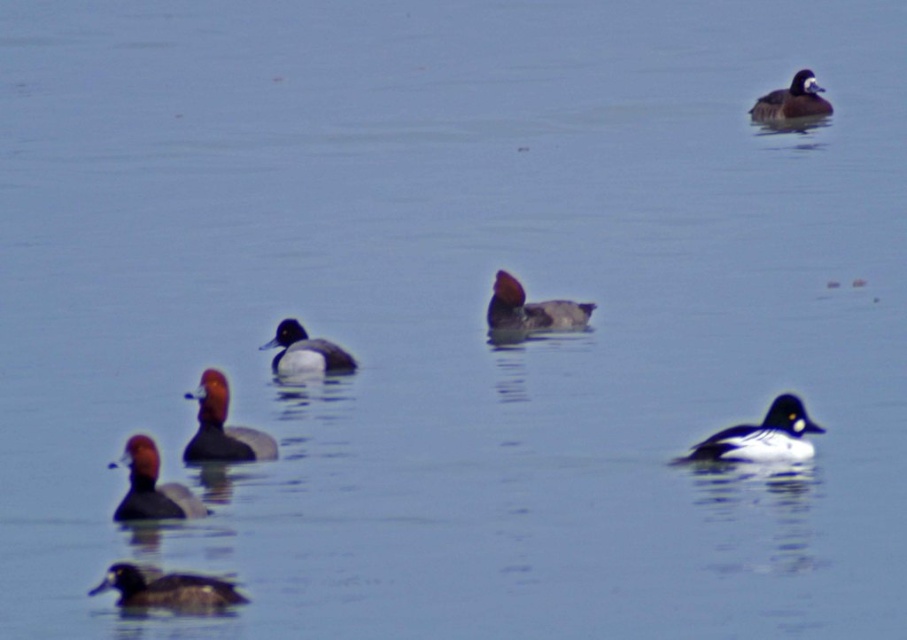
Identify the location of white glossy duck at right. The width and height of the screenshot is (907, 640). (762, 436).

Is white glossy duck at right positioned behind brown matte duck at center?

No, it is not.

What do you see at coordinates (762, 436) in the screenshot? I see `white glossy duck at right` at bounding box center [762, 436].

Where is `white glossy duck at right`? white glossy duck at right is located at coordinates (762, 436).

Who is more forward, (712, 449) or (138, 468)?

Positioned in front is point (138, 468).

Measure the distance between point [773,401] and camera.

9.67 meters

Is point (724, 460) in front of point (149, 492)?

No, (724, 460) is further to viewer.

You are a GUI agent. You are given a task and a screenshot of the screen. Output one action in this format:
    pyautogui.click(x=<x>, y=<y>)
    Task: Click on the white glossy duck at right
    
    Given the screenshot: What is the action you would take?
    [x=762, y=436]

How distant is white glossy duck at right from dark brown duck at lower left?

white glossy duck at right and dark brown duck at lower left are 3.36 meters apart from each other.

Find the location of a particular element. The height and width of the screenshot is (640, 907). white glossy duck at right is located at coordinates click(x=762, y=436).

What do you see at coordinates (762, 436) in the screenshot? The image size is (907, 640). I see `white glossy duck at right` at bounding box center [762, 436].

Locate an element on the screen. white glossy duck at right is located at coordinates (762, 436).